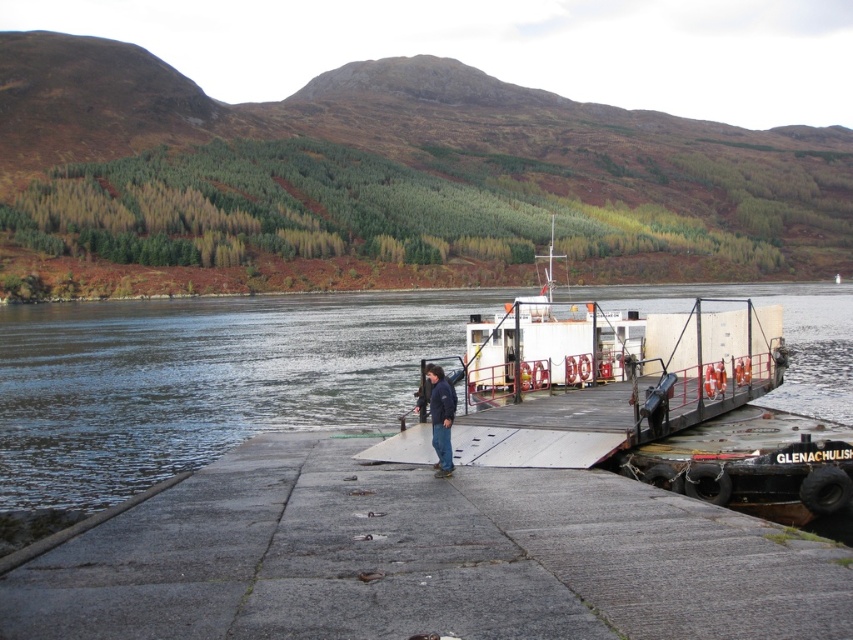
You are a boat captain planning to dock your vessel at the pier. Based on the scene, where would you position your boat relative to the clear water at dock center?

The clear water at dock center is located at point (198, 380), so you should position your boat near that coordinate to ensure proper docking alignment.

You are a tourist standing on the gray concrete dock at center and looking towards the clear water at dock center. Which object is closer to your eyes?

The gray concrete dock at center is closer to your eyes because it is located below the clear water at dock center, meaning the water is above the dock.

You are standing on the pier and want to check if the clear water at dock center is above or below the dark blue jacket at center. According to the scene, what is the relationship between their positions?

The clear water at dock center is located above the dark blue jacket at center, meaning the water is positioned higher than the jacket in the scene.